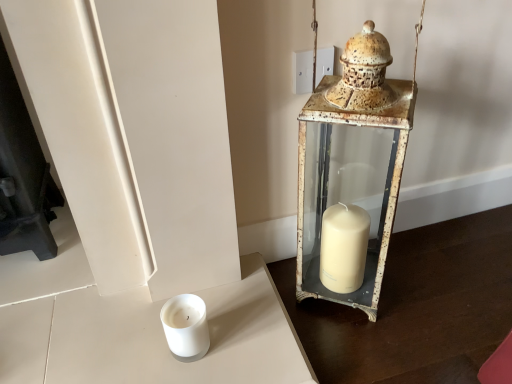
Question: Should I look upward or downward to see white matte candle at lower left?

Choices:
 (A) up
 (B) down

Answer: (B)

Question: Considering the relative positions of white matte candle at lower left and rusty metal lantern at right in the image provided, is white matte candle at lower left to the left of rusty metal lantern at right from the viewer's perspective?

Choices:
 (A) yes
 (B) no

Answer: (A)

Question: From a real-world perspective, is white matte candle at lower left on rusty metal lantern at right?

Choices:
 (A) no
 (B) yes

Answer: (A)

Question: From the image's perspective, is white matte candle at lower left on rusty metal lantern at right?

Choices:
 (A) yes
 (B) no

Answer: (B)

Question: Is white matte candle at lower left directly adjacent to rusty metal lantern at right?

Choices:
 (A) yes
 (B) no

Answer: (B)

Question: Does white matte candle at lower left lie in front of rusty metal lantern at right?

Choices:
 (A) yes
 (B) no

Answer: (B)

Question: Is white matte candle at lower left bigger than rusty metal lantern at right?

Choices:
 (A) no
 (B) yes

Answer: (A)

Question: Could you tell me if rusty metal lantern at right is facing white matte candle at lower left?

Choices:
 (A) no
 (B) yes

Answer: (A)

Question: Is rusty metal lantern at right placed right next to white matte candle at lower left?

Choices:
 (A) yes
 (B) no

Answer: (B)

Question: Is rusty metal lantern at right bigger than white matte candle at lower left?

Choices:
 (A) yes
 (B) no

Answer: (A)

Question: Does rusty metal lantern at right have a lesser height compared to white matte candle at lower left?

Choices:
 (A) yes
 (B) no

Answer: (B)

Question: Does rusty metal lantern at right have a smaller size compared to white matte candle at lower left?

Choices:
 (A) yes
 (B) no

Answer: (B)

Question: From a real-world perspective, is rusty metal lantern at right physically above white matte candle at lower left?

Choices:
 (A) no
 (B) yes

Answer: (B)

Question: From the image's perspective, is white matte candle at lower left positioned above or below rusty metal lantern at right?

Choices:
 (A) above
 (B) below

Answer: (B)